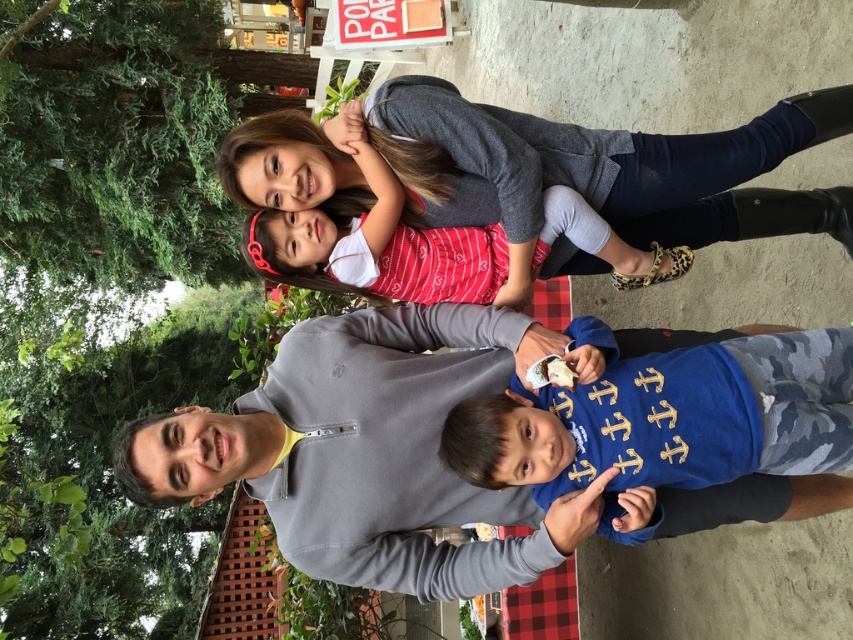
Question: Based on their relative distances, which object is farther from the blue camouflage shirt at center?

Choices:
 (A) gray fleece at center
 (B) red striped shirt at upper center

Answer: (B)

Question: Does gray fleece at center appear on the left side of red striped shirt at upper center?

Choices:
 (A) yes
 (B) no

Answer: (A)

Question: Which object is the closest to the red striped shirt at upper center?

Choices:
 (A) gray fleece at center
 (B) blue camouflage shirt at center

Answer: (A)

Question: Is gray fleece at center to the left of red striped shirt at upper center from the viewer's perspective?

Choices:
 (A) no
 (B) yes

Answer: (B)

Question: Is gray fleece at center below red striped shirt at upper center?

Choices:
 (A) yes
 (B) no

Answer: (A)

Question: Which object is closer to the camera taking this photo?

Choices:
 (A) red striped shirt at upper center
 (B) blue camouflage shirt at center
 (C) gray fleece at center

Answer: (B)